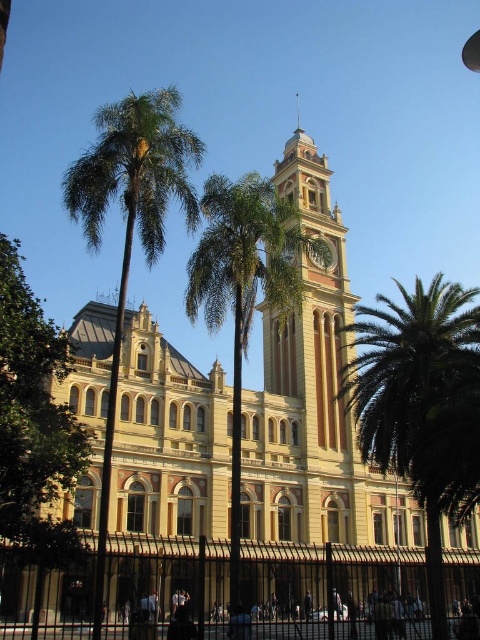
Can you confirm if green leafy palm at center is thinner than light brown stone clock tower at center?

Incorrect, green leafy palm at center's width is not less than light brown stone clock tower at center's.

Looking at this image, can you confirm if green leafy palm at center is bigger than light brown stone clock tower at center?

Indeed, green leafy palm at center has a larger size compared to light brown stone clock tower at center.

Is point (272, 211) closer to viewer compared to point (312, 298)?

That is True.

Locate an element on the screen. green leafy palm at center is located at coordinates (243, 285).

Can you confirm if green leafy palm at right is taller than green leafy palm tree at left?

In fact, green leafy palm at right may be shorter than green leafy palm tree at left.

Does green leafy palm at right appear under green leafy palm tree at left?

Yes.

Does point (369, 353) come in front of point (166, 196)?

No.

You are a GUI agent. You are given a task and a screenshot of the screen. Output one action in this format:
    pyautogui.click(x=<x>, y=<y>)
    Task: Click on the green leafy palm at right
    
    Given the screenshot: What is the action you would take?
    pyautogui.click(x=421, y=404)

Does green leafy palm at center have a lesser height compared to gold metallic clock at center?

No.

Consider the image. Can you confirm if green leafy palm at center is positioned to the left of gold metallic clock at center?

Correct, you'll find green leafy palm at center to the left of gold metallic clock at center.

Is point (266, 241) closer to camera compared to point (326, 259)?

Yes, point (266, 241) is in front of point (326, 259).

This screenshot has height=640, width=480. Identify the location of green leafy palm at center. tap(243, 285).